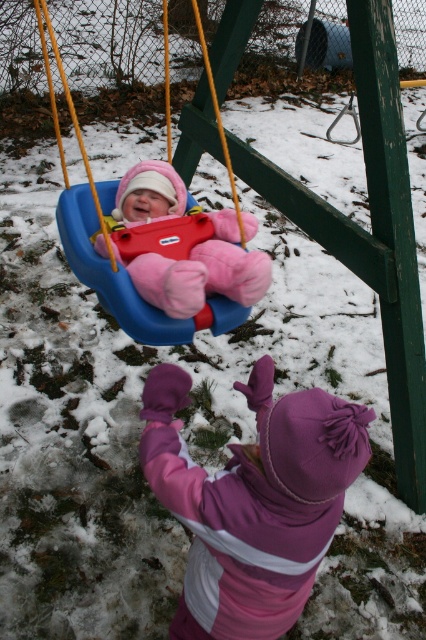
The image size is (426, 640). What do you see at coordinates (253, 500) in the screenshot?
I see `purple fleece mittens at lower center` at bounding box center [253, 500].

In the scene shown: Can you confirm if purple fleece mittens at lower center is taller than pink fleece baby at center?

Indeed, purple fleece mittens at lower center has a greater height compared to pink fleece baby at center.

Is point (327, 484) positioned before point (229, 256)?

Yes, it is in front of point (229, 256).

Locate an element on the screen. Image resolution: width=426 pixels, height=640 pixels. purple fleece mittens at lower center is located at coordinates (253, 500).

Does pink fleece baby at center appear on the left side of blue plastic swing at center?

In fact, pink fleece baby at center is to the right of blue plastic swing at center.

Where is `pink fleece baby at center`? Image resolution: width=426 pixels, height=640 pixels. pink fleece baby at center is located at coordinates (201, 272).

Does purple fleece mittens at lower center appear under blue plastic swing at center?

Yes, purple fleece mittens at lower center is below blue plastic swing at center.

Who is more forward, (195, 564) or (109, 212)?

Positioned in front is point (195, 564).

This screenshot has height=640, width=426. In order to click on purple fleece mittens at lower center in this screenshot , I will do `click(253, 500)`.